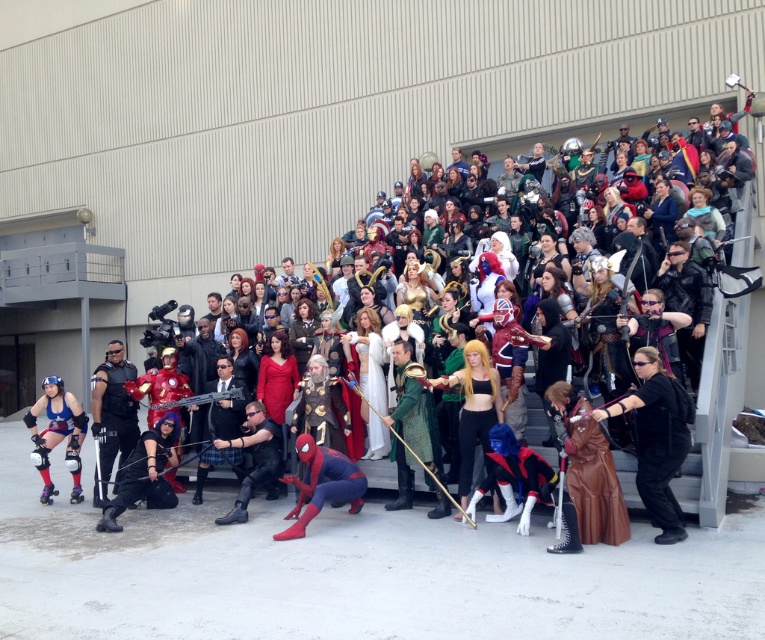
You are a photographer at the event and want to capture both the black leather jacket at lower right and the black leather jacket at center in a single frame. Which jacket should you focus on to ensure both are visible without zooming in too much?

The black leather jacket at lower right is larger in size compared to the black leather jacket at center. To capture both without zooming in too much, focus on the larger jacket at lower right as it will take up more space in the frame, allowing the smaller one at center to still be visible.